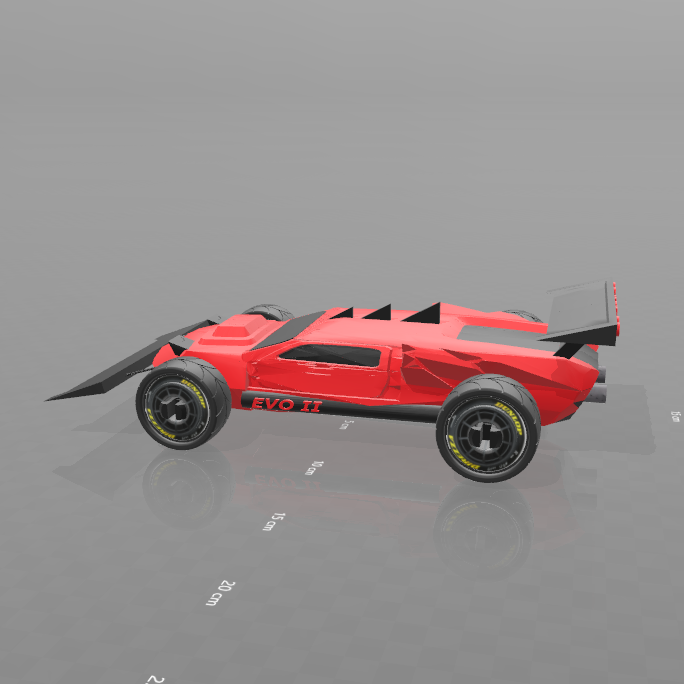
Locate an element on the screen. This screenshot has height=684, width=684. window is located at coordinates (343, 354).